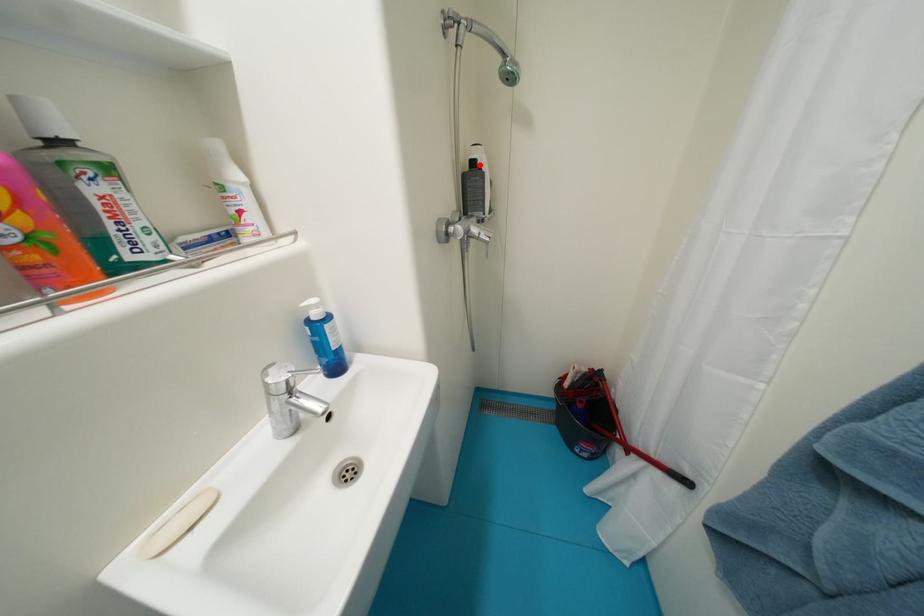
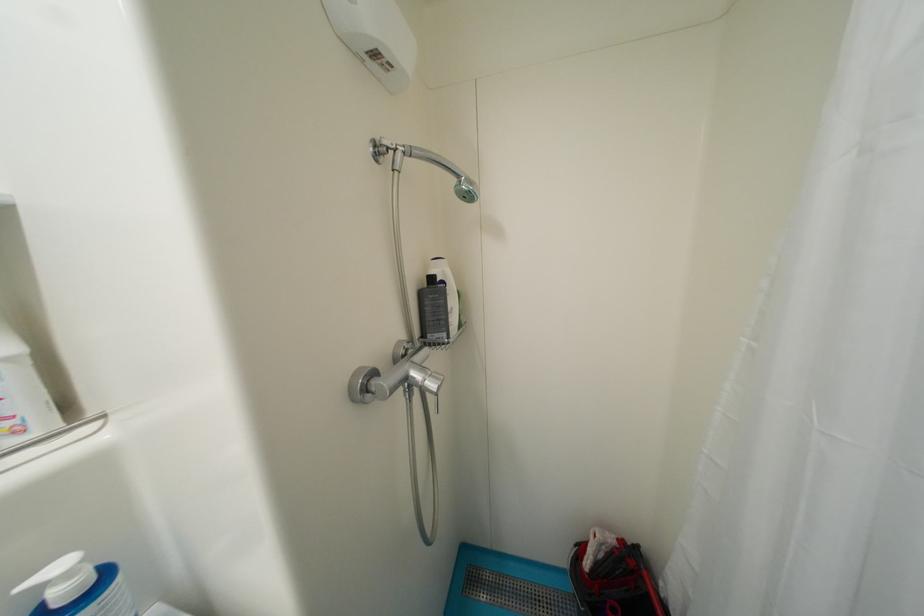
Where in the second image is the point corresponding to the highlighted location from the first image?

(439, 281)